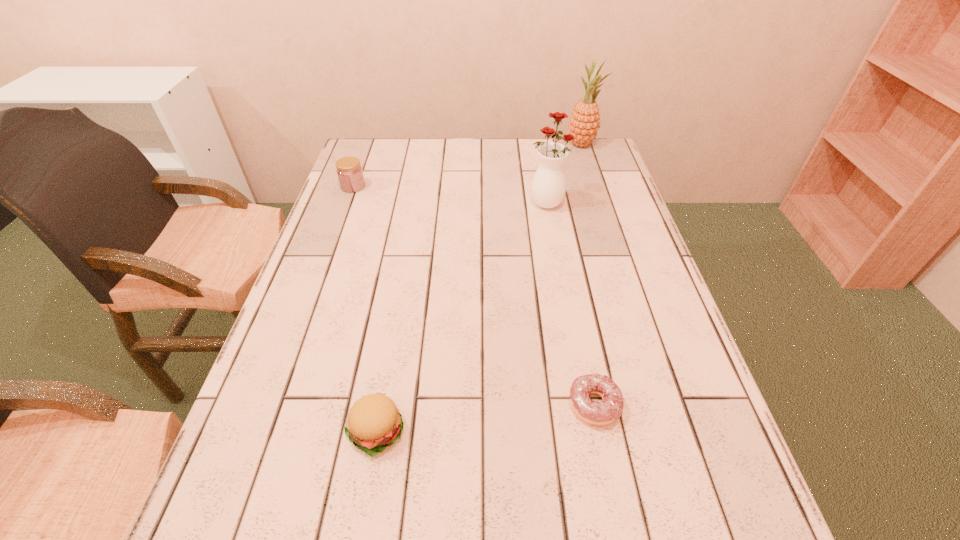
Identify the location of vacant position located on the front of the third shortest object. (342, 218).

I want to click on free location located 0.100m on the back of the second object from left to right, so click(x=388, y=359).

The height and width of the screenshot is (540, 960). I want to click on vacant space positioned 0.350m on the left of the shortest object, so click(380, 406).

You are a GUI agent. You are given a task and a screenshot of the screen. Output one action in this format:
    pyautogui.click(x=<x>, y=<y>)
    Task: Click on the object positioned at the far edge
    
    Given the screenshot: What is the action you would take?
    pyautogui.click(x=584, y=123)

Where is `object located at the left edge`? object located at the left edge is located at coordinates (349, 171).

Find the location of a particular element. object at the right edge is located at coordinates (584, 123).

What are the coordinates of `object at the far right corner` in the screenshot? It's located at (584, 123).

Find the location of `vacant space at the far edge`. vacant space at the far edge is located at coordinates (549, 143).

Image resolution: width=960 pixels, height=540 pixels. I want to click on vacant space at the near edge of the desktop, so click(x=424, y=536).

You are a GUI agent. You are given a task and a screenshot of the screen. Output one action in this format:
    pyautogui.click(x=<x>, y=<y>)
    Task: Click on the free point at the left edge
    
    Given the screenshot: What is the action you would take?
    pyautogui.click(x=324, y=233)